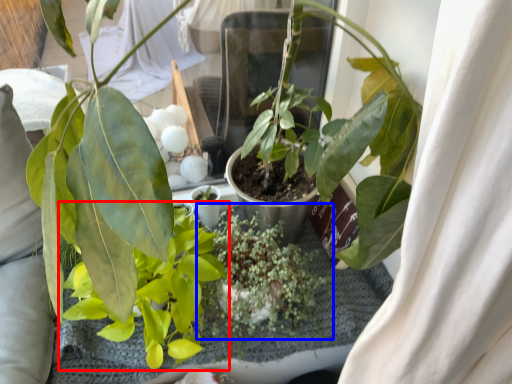
Question: Which point is further to the camera, houseplant (highlighted by a red box) or houseplant (highlighted by a blue box)?

Choices:
 (A) houseplant
 (B) houseplant

Answer: (B)